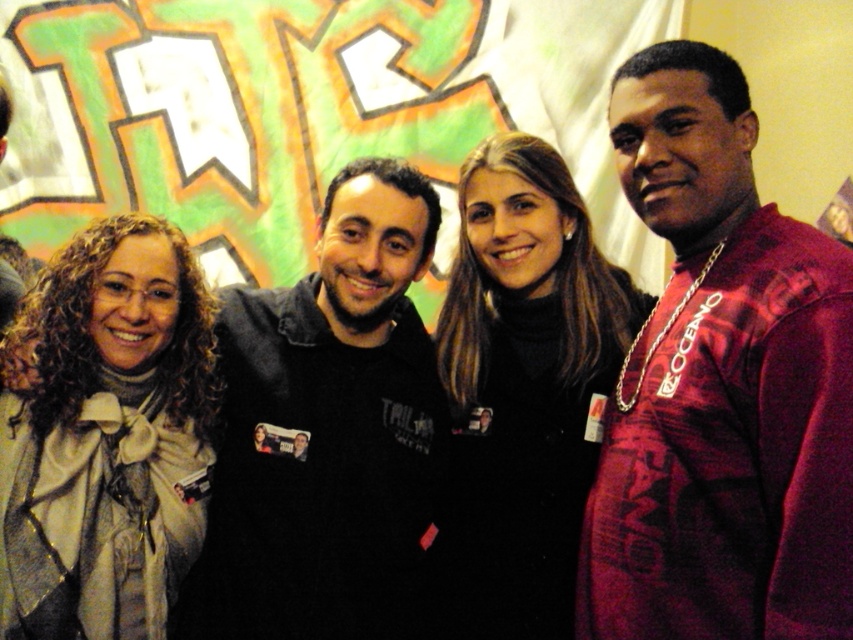
In the scene shown: Based on the scene description, if you were to look at the group from the front, which object would you see first between the shiny maroon shirt at right and the light beige scarf at center?

The shiny maroon shirt at right is above the light beige scarf at center, so you would see the shiny maroon shirt at right first.

You are a photographer setting up for a group photo. You need to ensure that the shiny maroon shirt at right and the light beige scarf at center are both visible in the frame. Based on their heights, which object should you adjust the camera angle to focus on first?

The shiny maroon shirt at right is taller than the light beige scarf at center, so you should adjust the camera angle to focus on the shiny maroon shirt at right first to ensure both are visible.